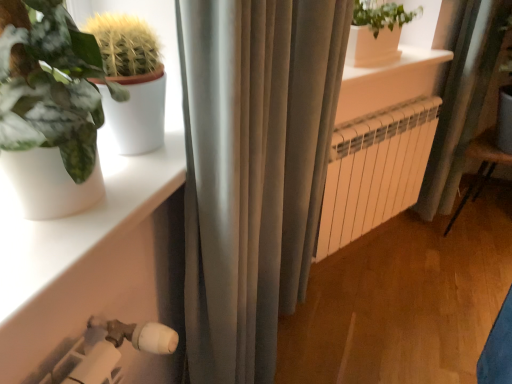
What are the coordinates of `free space above white matte shelf at lower left (from a real-world perspective)` in the screenshot? It's located at (101, 202).